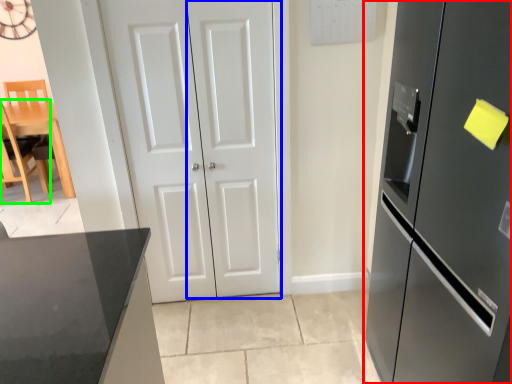
Question: Which object is the farthest from refrigerator (highlighted by a red box)? Choose among these: door (highlighted by a blue box) or chair (highlighted by a green box).

Choices:
 (A) door
 (B) chair

Answer: (B)